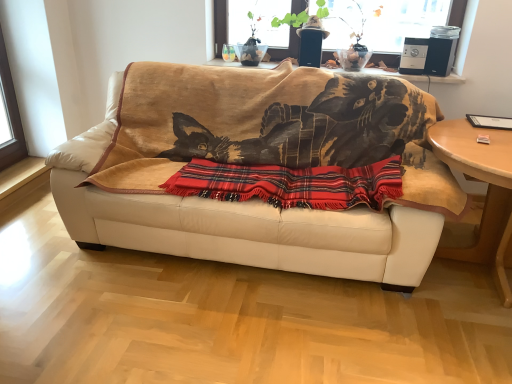
Question: Relative to red plaid blanket at center, is wooden round table at right in front or behind?

Choices:
 (A) front
 (B) behind

Answer: (A)

Question: Choose the correct answer: Is wooden round table at right inside red plaid blanket at center or outside it?

Choices:
 (A) inside
 (B) outside

Answer: (B)

Question: Estimate the real-world distances between objects in this image. Which object is closer to the leather couch at center?

Choices:
 (A) smooth glass window sill at upper center
 (B) red plaid blanket at center
 (C) wooden round table at right

Answer: (B)

Question: Estimate the real-world distances between objects in this image. Which object is farther from the wooden round table at right?

Choices:
 (A) leather couch at center
 (B) smooth glass window sill at upper center
 (C) red plaid blanket at center

Answer: (B)